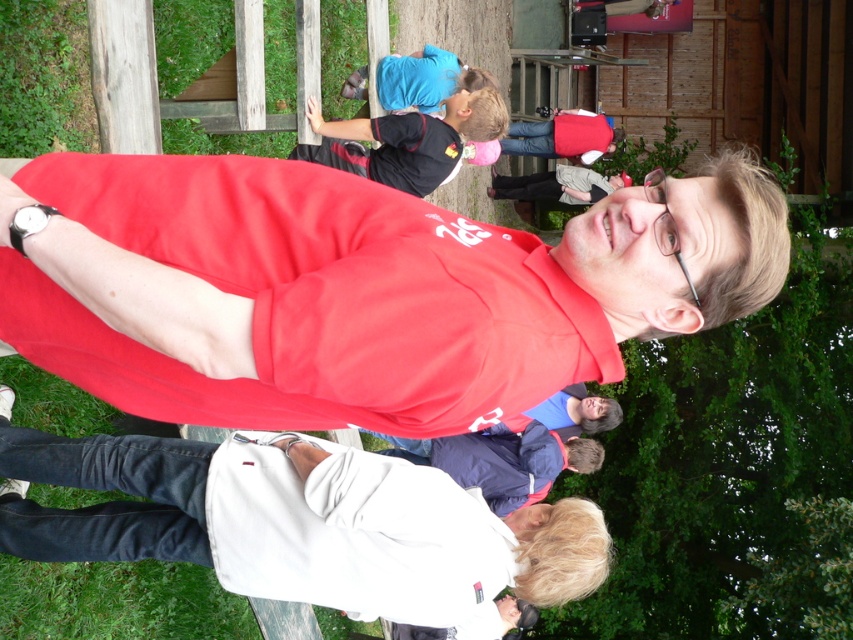
Can you confirm if matte red shirt at center is thinner than white matte jacket at center?

Yes.

Does point (521, 243) come farther from viewer compared to point (341, 538)?

That is False.

Find the location of a particular element. matte red shirt at center is located at coordinates (372, 289).

Does white matte jacket at center appear on the right side of black jersey at upper center?

Incorrect, white matte jacket at center is not on the right side of black jersey at upper center.

Who is more distant from viewer, (115, 541) or (479, 120)?

The point (479, 120) is more distant.

Which is in front, point (200, 452) or point (468, 118)?

Point (200, 452) is in front.

Find the location of a particular element. The height and width of the screenshot is (640, 853). white matte jacket at center is located at coordinates (296, 522).

Can you confirm if matte red shirt at center is thinner than black jersey at upper center?

No, matte red shirt at center is not thinner than black jersey at upper center.

Describe the element at coordinates (372, 289) in the screenshot. I see `matte red shirt at center` at that location.

Where is `matte red shirt at center`? Image resolution: width=853 pixels, height=640 pixels. matte red shirt at center is located at coordinates (372, 289).